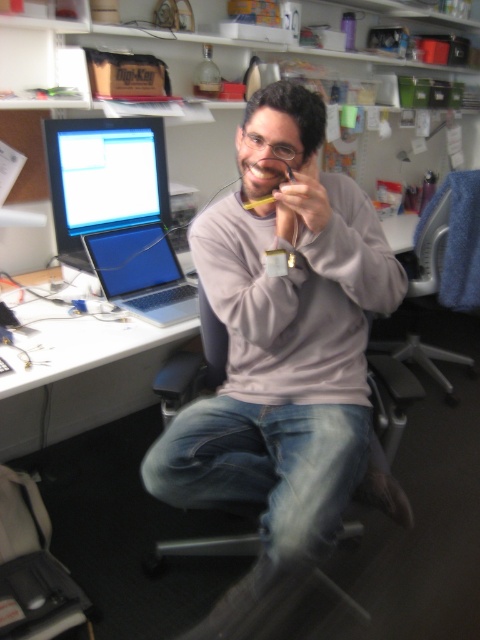
Question: Does white plastic table at center appear under matte black monitor at upper left?

Choices:
 (A) no
 (B) yes

Answer: (B)

Question: Considering the real-world distances, which object is closest to the white plastic table at center?

Choices:
 (A) gray matte sweatshirt at center
 (B) silver metallic laptop at left

Answer: (B)

Question: Among these points, which one is farthest from the camera?

Choices:
 (A) (368, 198)
 (B) (143, 378)
 (C) (92, 150)

Answer: (B)

Question: Which of these objects is positioned farthest from the matte black monitor at upper left?

Choices:
 (A) gray matte sweatshirt at center
 (B) silver metallic laptop at left

Answer: (A)

Question: Considering the relative positions of gray matte sweatshirt at center and matte black monitor at upper left in the image provided, where is gray matte sweatshirt at center located with respect to matte black monitor at upper left?

Choices:
 (A) above
 (B) below

Answer: (B)

Question: Is gray fabric swivel chair at right to the right of silver metallic laptop at left from the viewer's perspective?

Choices:
 (A) no
 (B) yes

Answer: (B)